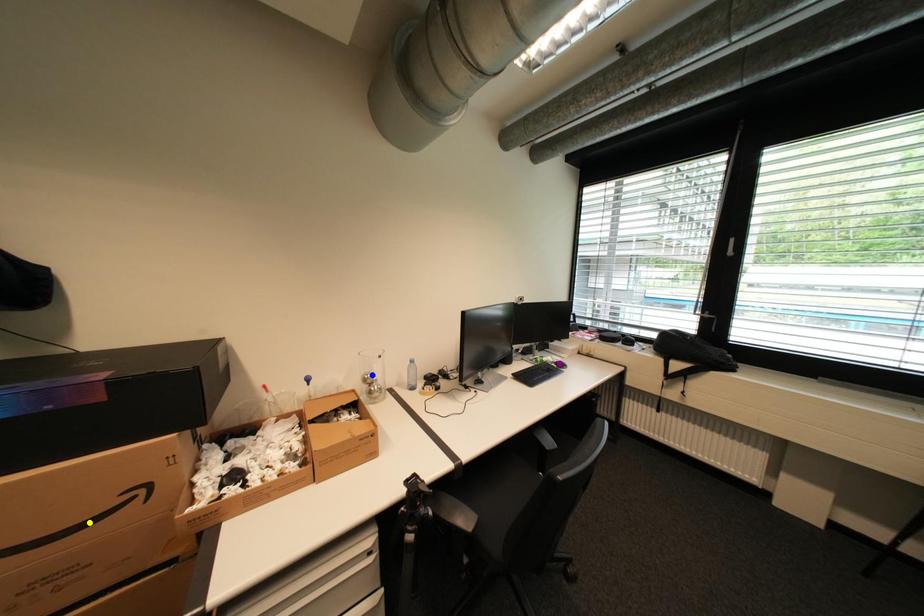
Order these from nearest to farthest:
blue point
purple point
yellow point

yellow point → blue point → purple point